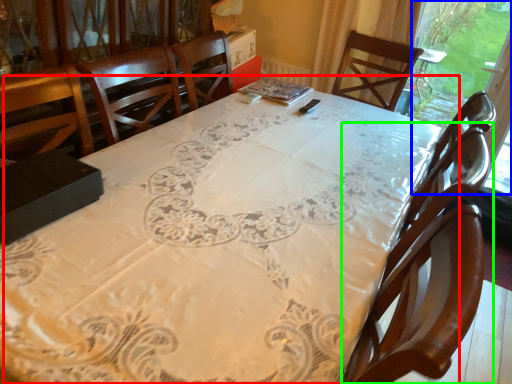
Question: Estimate the real-world distances between objects in this image. Which object is farther from table (highlighted by a red box), window screen (highlighted by a blue box) or chair (highlighted by a green box)?

Choices:
 (A) window screen
 (B) chair

Answer: (A)